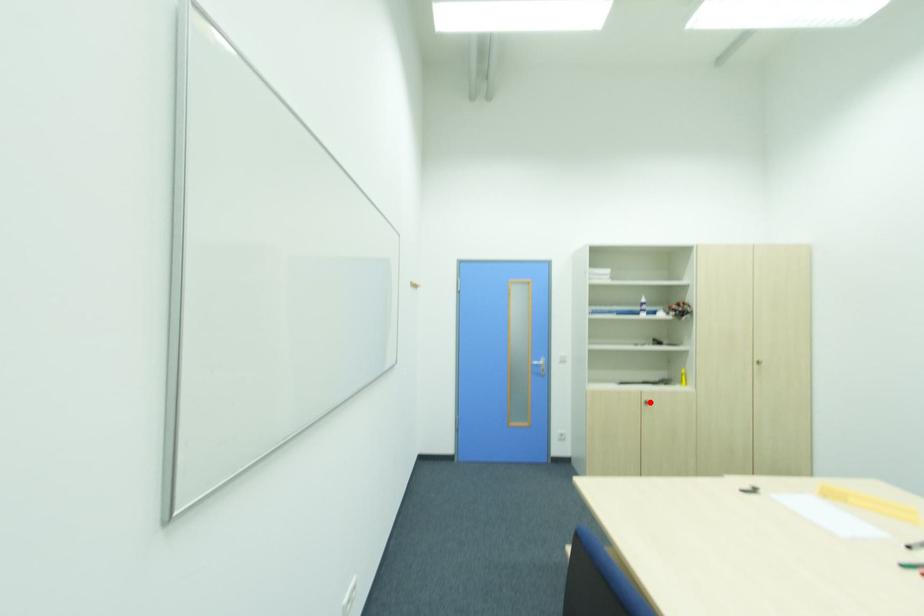
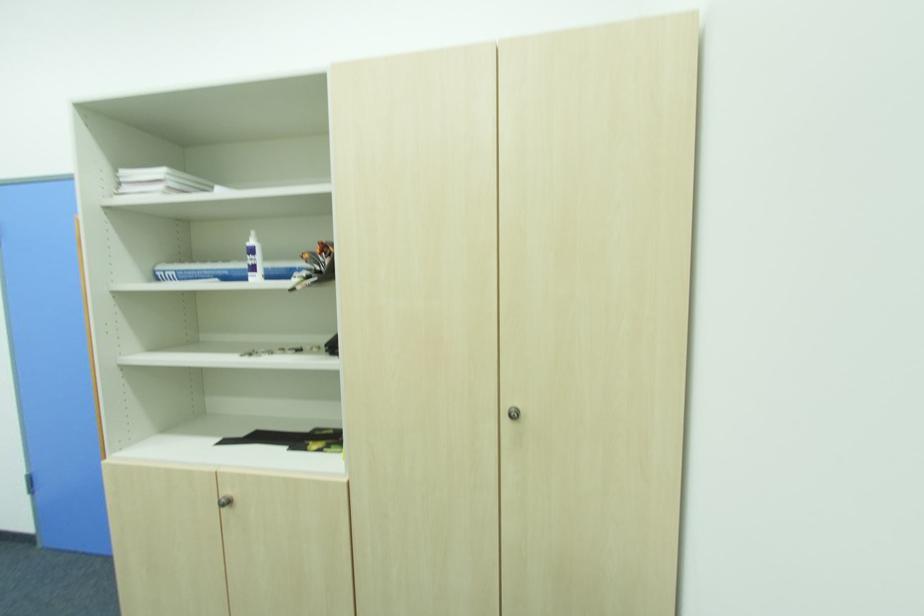
In the second image, find the point that corresponds to the highlighted location in the first image.

(229, 504)